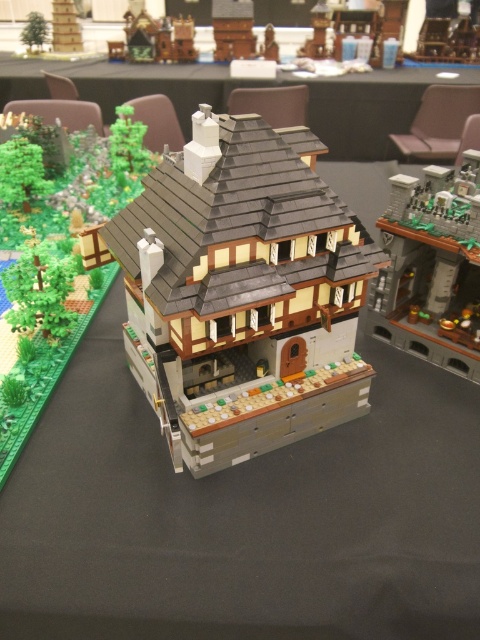
Question: Does brick-like brown house at center have a larger size compared to smooth gray table at center?

Choices:
 (A) no
 (B) yes

Answer: (A)

Question: Does brick-like brown house at center come in front of smooth gray table at center?

Choices:
 (A) no
 (B) yes

Answer: (B)

Question: Does brick-like brown house at center have a smaller size compared to smooth gray table at center?

Choices:
 (A) no
 (B) yes

Answer: (B)